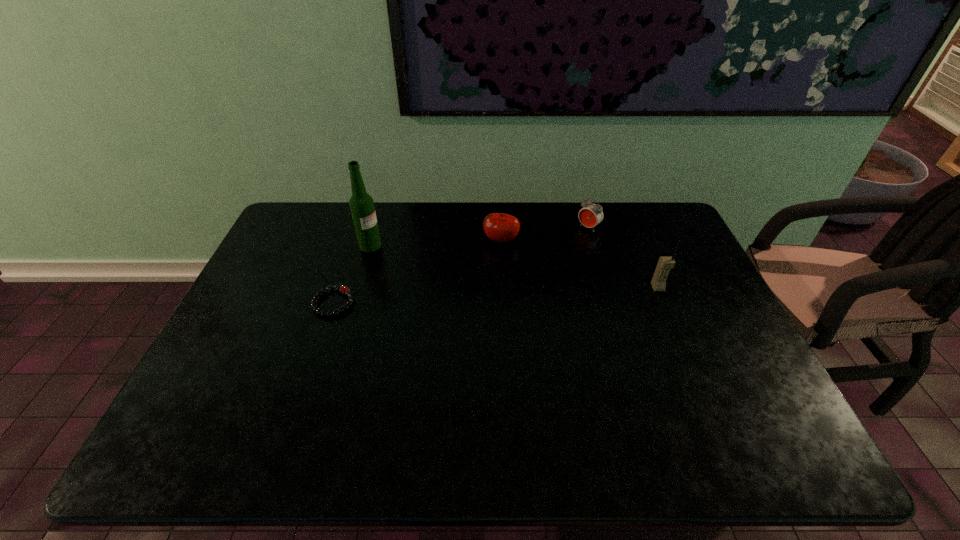
The height and width of the screenshot is (540, 960). I want to click on bracelet, so click(345, 290).

Find the location of a particular element. the rightmost object is located at coordinates (658, 282).

I want to click on cellular telephone, so click(658, 282).

Identify the location of alarm clock. The height and width of the screenshot is (540, 960). (591, 214).

This screenshot has width=960, height=540. Find the location of `the third object from left to right`. the third object from left to right is located at coordinates tap(499, 227).

Locate an element on the screen. This screenshot has height=540, width=960. beer bottle is located at coordinates (361, 204).

Locate an element on the screen. This screenshot has width=960, height=540. vacant space located on the back of the shortest object is located at coordinates 357,234.

The height and width of the screenshot is (540, 960). Identify the location of free space located on the front of the second tallest object, where the keypad is located. (675, 329).

Find the location of a particular element. The height and width of the screenshot is (540, 960). free space located on the face of the second object from right to left is located at coordinates (544, 265).

You are a GUI agent. You are given a task and a screenshot of the screen. Output one action in this format:
    pyautogui.click(x=<x>, y=<y>)
    Task: Click on the vacant space located 0.160m on the face of the second object from right to left
    
    Given the screenshot: What is the action you would take?
    pyautogui.click(x=556, y=255)